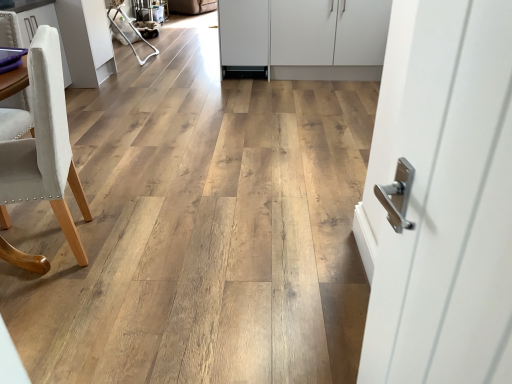
This screenshot has width=512, height=384. Describe the element at coordinates (132, 29) in the screenshot. I see `white fabric armchair at upper left` at that location.

What is the approximate width of white fabric chair at left, acting as the 2th cabinetry starting from the back?

white fabric chair at left, acting as the 2th cabinetry starting from the back, is 40.56 centimeters in width.

Describe the element at coordinates (306, 37) in the screenshot. I see `white matte cabinet at center, the first cabinetry in the right-to-left sequence` at that location.

At what (x,y) coordinates should I click in order to perform the action: click on white matte cabinet at center, which is the second cabinetry from front to back. Please return your answer as a coordinate pair (x, y). Looking at the image, I should click on (306, 37).

Find the location of a particular element. The image size is (512, 384). white fabric armchair at upper left is located at coordinates (132, 29).

Which is correct: white fabric armchair at upper left is inside light beige fabric chair at left, or outside of it?

white fabric armchair at upper left is not enclosed by light beige fabric chair at left.

Looking at this image, what's the angular difference between white fabric armchair at upper left and light beige fabric chair at left's facing directions?

162 degrees separate the facing orientations of white fabric armchair at upper left and light beige fabric chair at left.

Which object is positioned more to the right, white fabric armchair at upper left or light beige fabric chair at left?

light beige fabric chair at left is more to the right.

Considering the positions of point (124, 35) and point (10, 225), is point (124, 35) closer or farther from the camera than point (10, 225)?

Point (124, 35) is farther from the camera than point (10, 225).

Who is taller, light beige fabric chair at left or white fabric chair at left, placed as the first cabinetry when sorted from left to right?

light beige fabric chair at left.

Are light beige fabric chair at left and white fabric chair at left, which is counted as the first cabinetry, starting from the front, beside each other?

No.

Is light beige fabric chair at left positioned behind white fabric chair at left, placed as the first cabinetry when sorted from left to right?

No, it is not.

Looking at this image, from a real-world perspective, is light beige fabric chair at left below white fabric chair at left, which is counted as the first cabinetry, starting from the front?

No.

From a real-world perspective, is light beige fabric chair at left below white fabric armchair at upper left?

No, from a real-world perspective, light beige fabric chair at left is not below white fabric armchair at upper left.

Where is `chair in front of the white fabric armchair at upper left`? chair in front of the white fabric armchair at upper left is located at coordinates (44, 146).

Which is behind, point (27, 176) or point (142, 60)?

Positioned behind is point (142, 60).

Find the location of a particular element. The height and width of the screenshot is (384, 512). chair on the left of white matte cabinet at center, the first cabinetry in the right-to-left sequence is located at coordinates (44, 146).

Is point (32, 70) positioned after point (371, 46)?

No, (32, 70) is closer to viewer.

From the image's perspective, is light beige fabric chair at left above or below white matte cabinet at center, which is the second cabinetry from front to back?

light beige fabric chair at left is situated lower than white matte cabinet at center, which is the second cabinetry from front to back, in the image.

In the image, is light beige fabric chair at left on the left side or the right side of white matte cabinet at center, which is the second cabinetry from front to back?

From the image, it's evident that light beige fabric chair at left is to the left of white matte cabinet at center, which is the second cabinetry from front to back.

Looking at the image, does white fabric chair at left, which is counted as the first cabinetry, starting from the front, seem bigger or smaller compared to white fabric armchair at upper left?

In the image, white fabric chair at left, which is counted as the first cabinetry, starting from the front, appears to be larger than white fabric armchair at upper left.

Find the location of a particular element. The width and height of the screenshot is (512, 384). armchair behind the white fabric chair at left, which is counted as the first cabinetry, starting from the front is located at coordinates (132, 29).

From a real-world perspective, is white fabric chair at left, acting as the 2th cabinetry starting from the back, above or below white fabric armchair at upper left?

white fabric chair at left, acting as the 2th cabinetry starting from the back, is situated higher than white fabric armchair at upper left in the real world.

Which object is positioned more to the left, white fabric chair at left, acting as the 2th cabinetry starting from the back, or white matte cabinet at center, which is the second cabinetry from front to back?

white fabric chair at left, acting as the 2th cabinetry starting from the back, is more to the left.

Does white fabric chair at left, acting as the 2th cabinetry starting from the back, have a lesser width compared to white matte cabinet at center, the first cabinetry in the right-to-left sequence?

Yes.

Is point (22, 29) closer or farther from the camera than point (273, 48)?

Point (22, 29).

What's the angular difference between white fabric chair at left, which is counted as the first cabinetry, starting from the front, and white matte cabinet at center, the first cabinetry in the right-to-left sequence,'s facing directions?

90.1 degrees separate the facing orientations of white fabric chair at left, which is counted as the first cabinetry, starting from the front, and white matte cabinet at center, the first cabinetry in the right-to-left sequence.

Is white matte cabinet at center, the first cabinetry in the right-to-left sequence, aimed at white fabric armchair at upper left?

No, white matte cabinet at center, the first cabinetry in the right-to-left sequence, is not aimed at white fabric armchair at upper left.

Is white matte cabinet at center, which is the second cabinetry from front to back, at the right side of white fabric armchair at upper left?

Yes.

Considering the sizes of white matte cabinet at center, which ranks as the second cabinetry in left-to-right order, and white fabric armchair at upper left in the image, is white matte cabinet at center, which ranks as the second cabinetry in left-to-right order, taller or shorter than white fabric armchair at upper left?

white matte cabinet at center, which ranks as the second cabinetry in left-to-right order, is taller than white fabric armchair at upper left.

Locate an element on the screen. armchair on the left of light beige fabric chair at left is located at coordinates (132, 29).

This screenshot has height=384, width=512. I want to click on chair on the right side of white fabric chair at left, placed as the first cabinetry when sorted from left to right, so click(x=44, y=146).

From the image, which object appears to be nearer to white fabric armchair at upper left, white fabric chair at left, acting as the 2th cabinetry starting from the back, or white matte cabinet at center, the first cabinetry positioned from the back?

Among the two, white fabric chair at left, acting as the 2th cabinetry starting from the back, is located nearer to white fabric armchair at upper left.

When comparing their distances from white fabric chair at left, acting as the 2th cabinetry starting from the back, does white fabric armchair at upper left or white matte cabinet at center, the first cabinetry positioned from the back, seem further?

Based on the image, white fabric armchair at upper left appears to be further to white fabric chair at left, acting as the 2th cabinetry starting from the back.

Looking at the image, which one is located closer to light beige fabric chair at left, white fabric chair at left, placed as the first cabinetry when sorted from left to right, or white matte cabinet at center, the first cabinetry positioned from the back?

Based on the image, white fabric chair at left, placed as the first cabinetry when sorted from left to right, appears to be nearer to light beige fabric chair at left.

Looking at the image, which one is located closer to white matte cabinet at center, the first cabinetry in the right-to-left sequence, white fabric armchair at upper left or white fabric chair at left, placed as the first cabinetry when sorted from left to right?

Based on the image, white fabric chair at left, placed as the first cabinetry when sorted from left to right, appears to be nearer to white matte cabinet at center, the first cabinetry in the right-to-left sequence.

Based on their spatial positions, is white matte cabinet at center, the first cabinetry positioned from the back, or light beige fabric chair at left closer to white fabric chair at left, positioned as the 2th cabinetry in right-to-left order?

light beige fabric chair at left is closer to white fabric chair at left, positioned as the 2th cabinetry in right-to-left order.

When comparing their distances from white fabric chair at left, placed as the first cabinetry when sorted from left to right, does white fabric armchair at upper left or light beige fabric chair at left seem closer?

The object closer to white fabric chair at left, placed as the first cabinetry when sorted from left to right, is light beige fabric chair at left.

From the image, which object appears to be nearer to white fabric armchair at upper left, light beige fabric chair at left or white fabric chair at left, acting as the 2th cabinetry starting from the back?

white fabric chair at left, acting as the 2th cabinetry starting from the back, lies closer to white fabric armchair at upper left than the other object.

Estimate the real-world distances between objects in this image. Which object is further from light beige fabric chair at left, white fabric armchair at upper left or white matte cabinet at center, which ranks as the second cabinetry in left-to-right order?

The object further to light beige fabric chair at left is white fabric armchair at upper left.

The width and height of the screenshot is (512, 384). Identify the location of cabinetry between light beige fabric chair at left and white matte cabinet at center, which is the second cabinetry from front to back, along the z-axis. (25, 21).

At what (x,y) coordinates should I click in order to perform the action: click on armchair between white fabric chair at left, positioned as the 2th cabinetry in right-to-left order, and white matte cabinet at center, the first cabinetry positioned from the back, from left to right. Please return your answer as a coordinate pair (x, y). The height and width of the screenshot is (384, 512). Looking at the image, I should click on (132, 29).